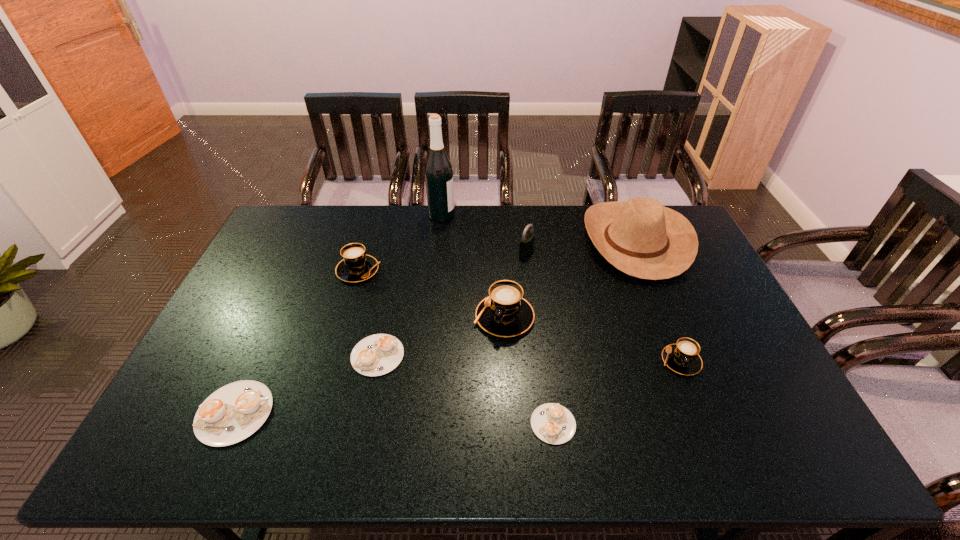
Identify which cappuccino is located as the nearest to the biggest white cappuccino. Please provide its 2D coordinates. Your answer should be formatted as a tuple, i.e. [(x, y)], where the tuple contains the x and y coordinates of a point satisfying the conditions above.

[(375, 355)]

Locate an element on the screen. black cappuccino identified as the second closest to the third tallest cappuccino is located at coordinates (356, 266).

Find the location of `the closest black cappuccino to the second tallest cappuccino`. the closest black cappuccino to the second tallest cappuccino is located at coordinates (504, 313).

Choose which white cappuccino is the third nearest neighbor to the third tallest cappuccino. Please provide its 2D coordinates. Your answer should be formatted as a tuple, i.e. [(x, y)], where the tuple contains the x and y coordinates of a point satisfying the conditions above.

[(232, 413)]

At what (x,y) coordinates should I click in order to perform the action: click on white cappuccino that is the second nearest to the dark wine bottle. Please return your answer as a coordinate pair (x, y). Looking at the image, I should click on (232, 413).

This screenshot has width=960, height=540. What are the coordinates of `free region that satisfies the following two spatial constraints: 1. on the front side of the farthest white cappuccino; 2. on the right side of the farthest cappuccino` in the screenshot? It's located at (333, 355).